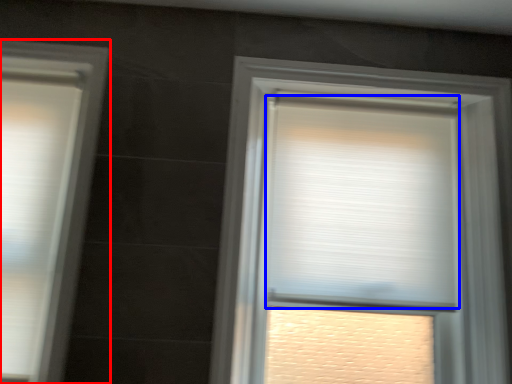
Question: Among these objects, which one is nearest to the camera, window (highlighted by a red box) or window blind (highlighted by a blue box)?

Choices:
 (A) window
 (B) window blind

Answer: (A)